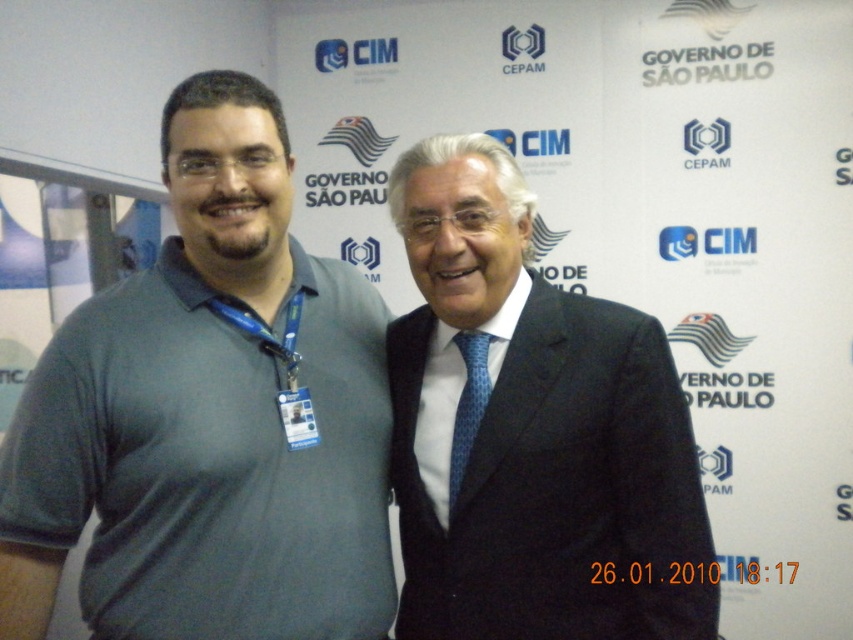
You are organizing a photo shoot and need to ensure that the dark gray suit at center and the blue dotted tie at center are visible in the frame. Given their sizes, which object should you focus on to ensure both are in focus?

The dark gray suit at center has a larger size compared to the blue dotted tie at center, so focusing on the dark gray suit at center would ensure both are in focus since it is the larger object.